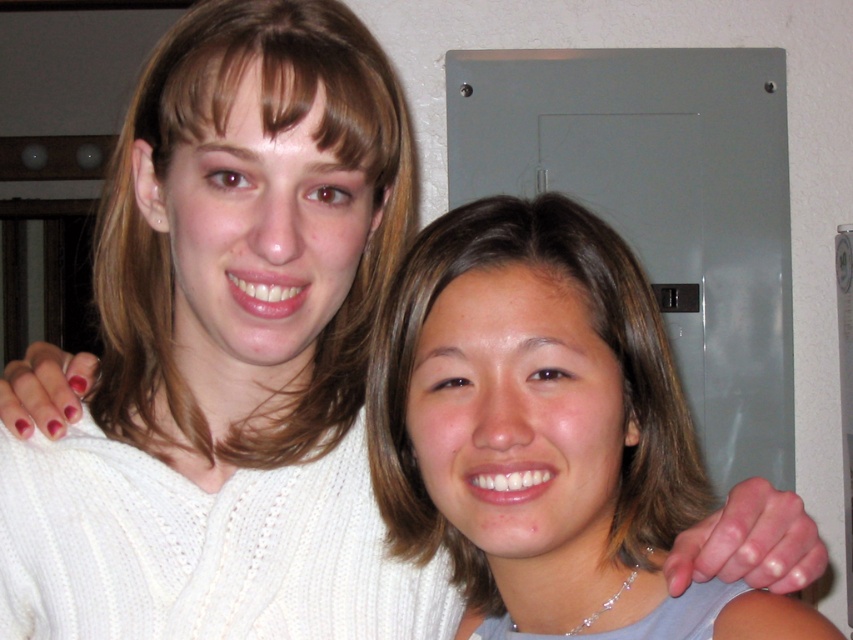
You are a photographer trying to capture a closeup of both the smooth brown hair at center and the blonde hair at upper left. Given that the camera can only focus on one subject at a time, which hair should you choose to ensure the subject with the larger size is in focus?

The blonde hair at upper left is larger in size compared to the smooth brown hair at center. Therefore, to focus on the larger subject, you should choose the blonde hair at upper left.

You are standing in the room where the two people are. You want to move from point A to point B. Point A is at coordinate point (524, 221) and point B is at coordinate point (184, 440). Which direction should you move to get closer to point B?

To move from point A at (524, 221) to point B at (184, 440), you should move downward and to the right because point B is located below and to the right of point A.

You are holding a 50 cm long ruler and want to measure the distance between yourself and the point at coordinates point (486, 502). Can you reach it with the ruler?

The point at coordinates point (486, 502) is 54.46 centimeters away from the viewer. Since the ruler is only 50 centimeters long, it is not long enough to reach that distance.